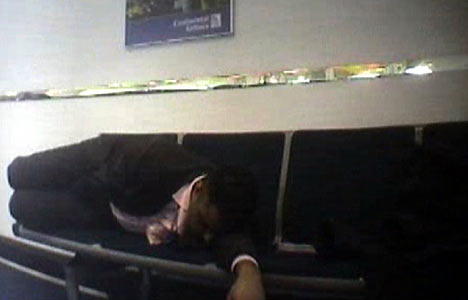
Where is `couch`? This screenshot has height=300, width=468. couch is located at coordinates (296, 228).